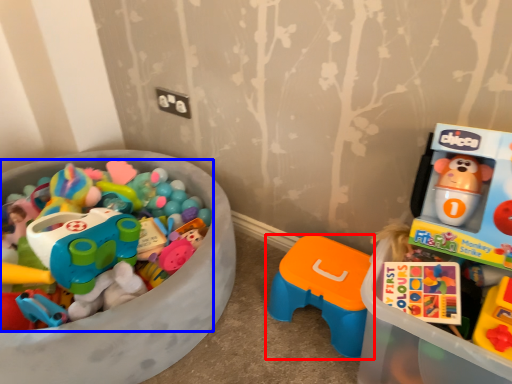
Question: Which object appears closest to the camera in this image, toy (highlighted by a red box) or toy (highlighted by a blue box)?

Choices:
 (A) toy
 (B) toy

Answer: (B)